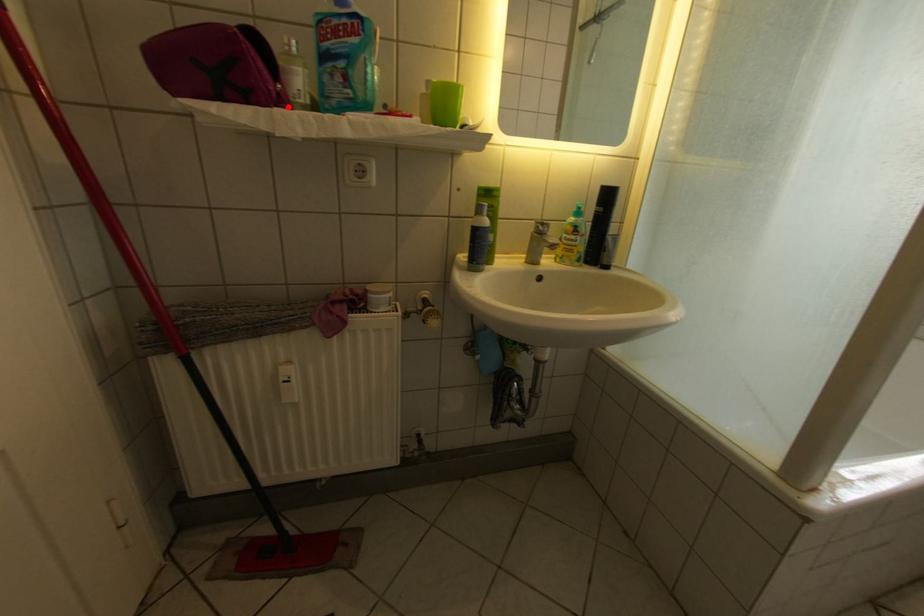
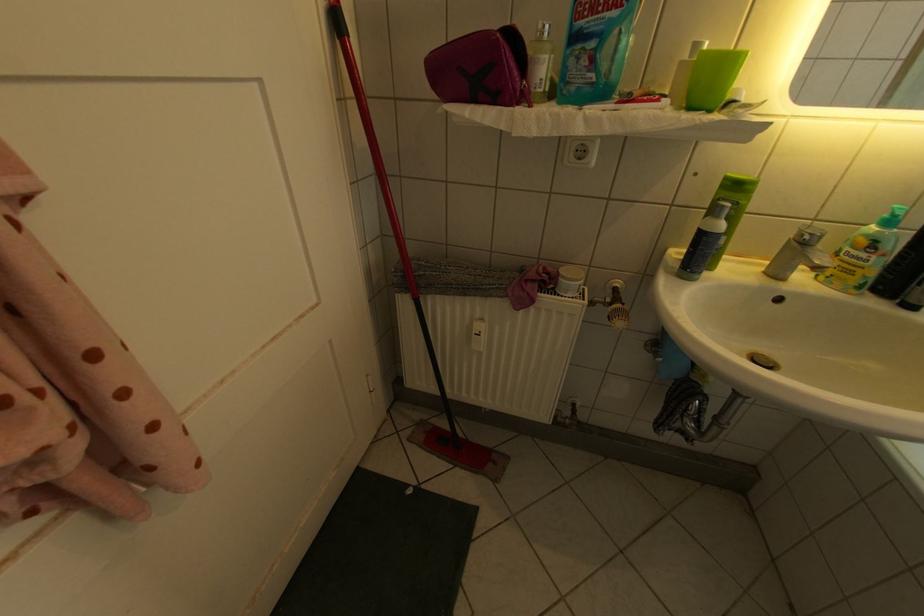
Question: I am providing you with two images of the same scene from different viewpoints. A red point is marked on the first image. Is the red point's position out of view in image 2?

Choices:
 (A) Yes
 (B) No

Answer: (B)